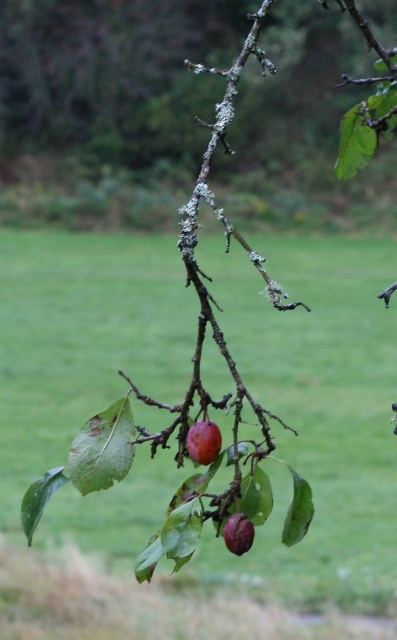
You are a photographer trying to capture the shiny purple plum at center in focus while keeping the green grass at center visible but less sharp. Based on the scene, can you adjust your camera settings to achieve this effect?

The green grass at center is in front of the shiny purple plum at center, so to focus on the plum while keeping the grass visible but less sharp, you should set your camera to a shallow depth of field and ensure the plum is the focal point behind the grass.

In the scene shown: You are a photographer standing at the camera position. You want to take a photo of the tree branch with the fruits. If you move 3 feet closer to the point at point (196,426), will the fruits become larger in your photo?

Moving 3 feet closer to the point at point (196,426) would reduce the distance from 6.94 feet to 3.94 feet. Since the fruits are on the branch near this point, they would appear larger in the photo due to the reduced distance.

You are a gardener who wants to pick the shiny red plum at center. Based on the scene, where should you look relative to the green grass at center?

The shiny red plum at center is above the green grass at center, so you should look upwards from the green grass at center to find the shiny red plum at center.